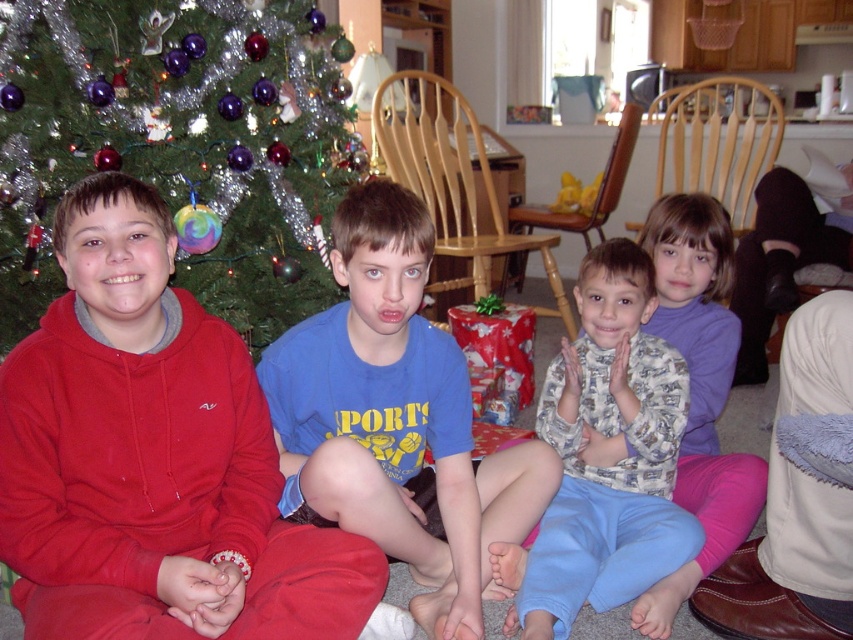
Looking at this image, is shiny green tree at left in front of blue cotton shirt at center?

No, shiny green tree at left is further to the viewer.

Consider the image. Can you confirm if shiny green tree at left is smaller than blue cotton shirt at center?

Incorrect, shiny green tree at left is not smaller in size than blue cotton shirt at center.

This screenshot has height=640, width=853. Identify the location of shiny green tree at left. (180, 145).

Looking at this image, does shiny green tree at left appear on the right side of printed cotton shirt at center?

Incorrect, shiny green tree at left is not on the right side of printed cotton shirt at center.

Does point (190, 128) come farther from viewer compared to point (659, 512)?

Yes, point (190, 128) is farther from viewer.

Where is `shiny green tree at left`? shiny green tree at left is located at coordinates (180, 145).

Can you confirm if matte red hoodie at left is smaller than purple fleece shirt at center?

Yes, matte red hoodie at left is smaller than purple fleece shirt at center.

Can you confirm if matte red hoodie at left is thinner than purple fleece shirt at center?

In fact, matte red hoodie at left might be wider than purple fleece shirt at center.

Does point (165, 412) come closer to viewer compared to point (654, 280)?

That is True.

The height and width of the screenshot is (640, 853). I want to click on matte red hoodie at left, so point(155,460).